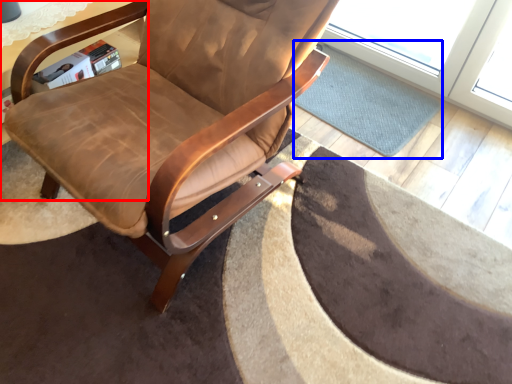
Question: Which point is closer to the camera, table (highlighted by a red box) or mat (highlighted by a blue box)?

Choices:
 (A) table
 (B) mat

Answer: (A)